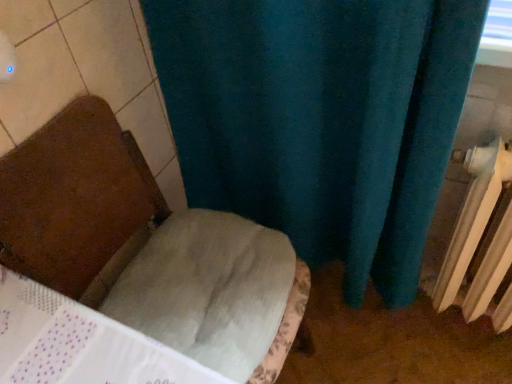
Question: Is white fabric chair at center spatially inside white plastic radiator at right, or outside of it?

Choices:
 (A) outside
 (B) inside

Answer: (A)

Question: Based on their sizes in the image, would you say white fabric chair at center is bigger or smaller than white plastic radiator at right?

Choices:
 (A) big
 (B) small

Answer: (A)

Question: From the image's perspective, is white fabric chair at center above or below white plastic radiator at right?

Choices:
 (A) below
 (B) above

Answer: (A)

Question: Considering the relative positions of white plastic radiator at right and white fabric chair at center in the image provided, is white plastic radiator at right to the left or to the right of white fabric chair at center?

Choices:
 (A) right
 (B) left

Answer: (A)

Question: From a real-world perspective, is white plastic radiator at right above or below white fabric chair at center?

Choices:
 (A) below
 (B) above

Answer: (A)

Question: Considering the positions of white plastic radiator at right and white fabric chair at center in the image, is white plastic radiator at right bigger or smaller than white fabric chair at center?

Choices:
 (A) small
 (B) big

Answer: (A)

Question: Is white plastic radiator at right wider or thinner than white fabric chair at center?

Choices:
 (A) wide
 (B) thin

Answer: (B)